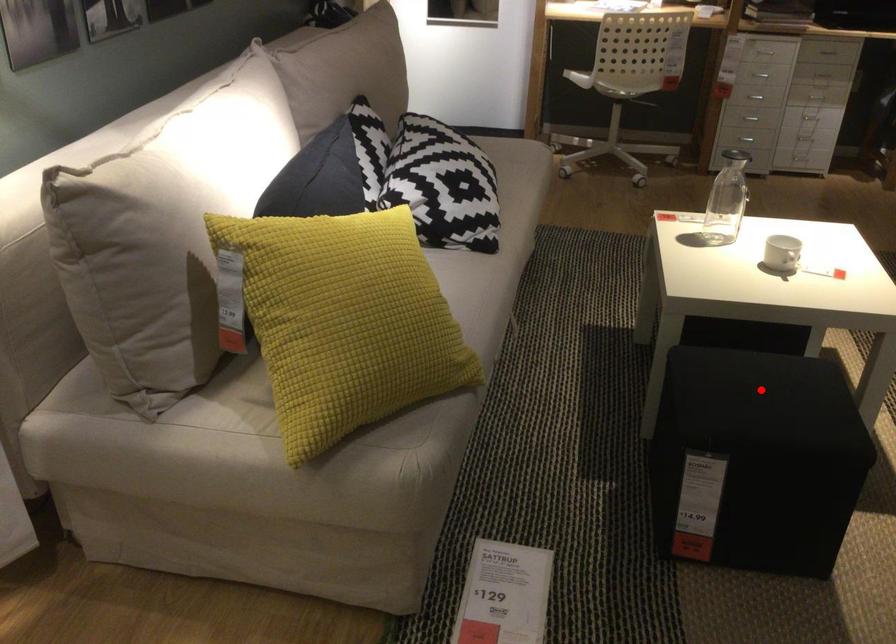
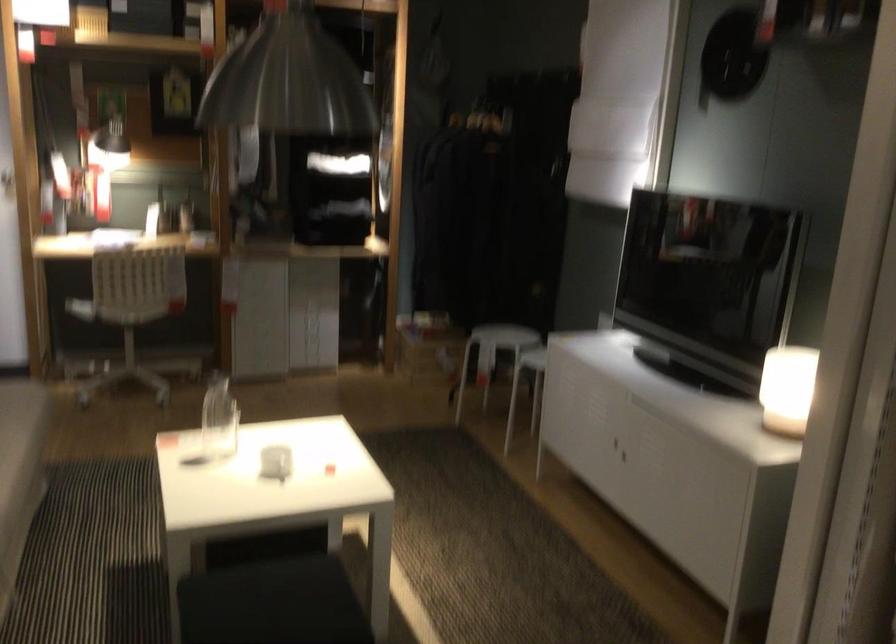
Question: I am providing you with two images of the same scene from different viewpoints. A red point is marked on the first image. At the location where the point appears in image 1, is it still visible in image 2?

Choices:
 (A) Yes
 (B) No

Answer: (A)